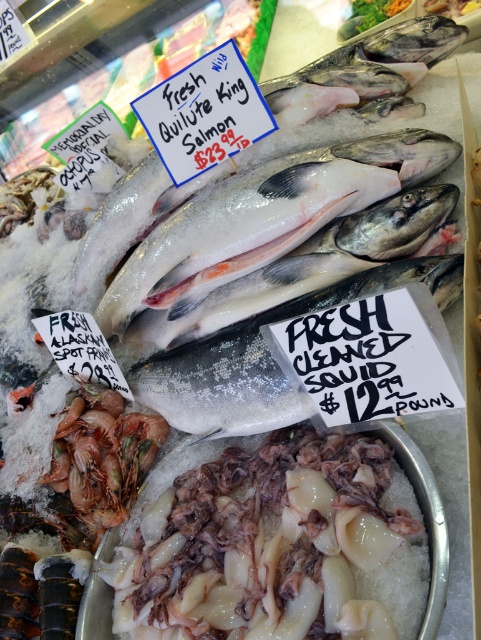
You are a customer at the seafood market and want to buy both the translucent white squid at center and the white glossy salmon at center. If you have a container that can only hold items up to the width of the salmon, will the squid fit in the container?

The translucent white squid at center has a lesser width compared to white glossy salmon at center, so the squid will fit in the container since its width is smaller than the salmon.

What is located at the coordinate point (266, 545) in the image?

At the coordinate point (266, 545) lies translucent white squid at center.

You are a customer at the seafood market and want to pick up the white glossy salmon at center and the shiny silver salmon at center. Which one do you need to reach further to grab?

The shiny silver salmon at center requires reaching further because the white glossy salmon at center is closer to the viewer.